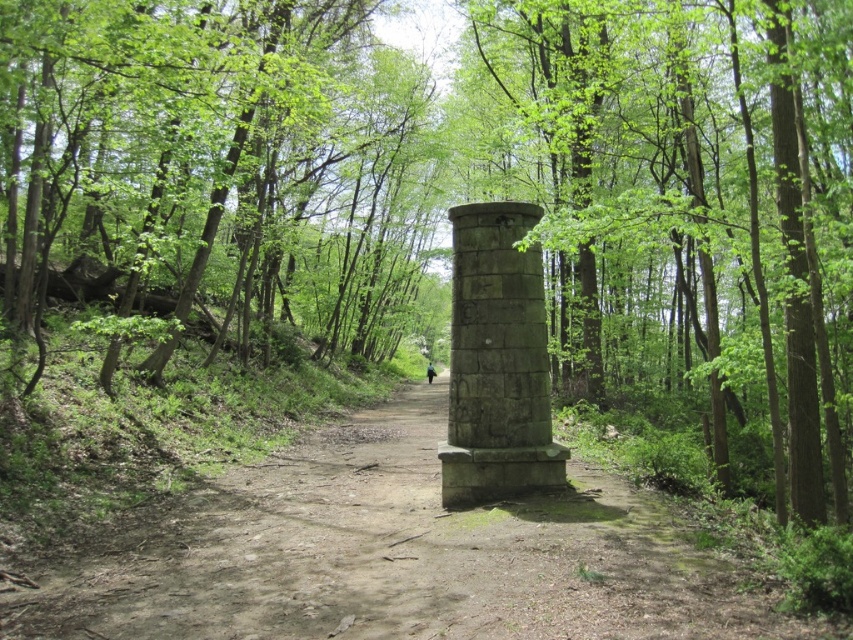
Between dull gray stone path at center and stone column at center, which one has less height?

Standing shorter between the two is dull gray stone path at center.

Is dull gray stone path at center closer to camera compared to stone column at center?

Yes.

Is point (80, 618) farther from viewer compared to point (809, 392)?

No, it is in front of (809, 392).

Where is `dull gray stone path at center`? The image size is (853, 640). dull gray stone path at center is located at coordinates (395, 556).

Who is more forward, (740, 138) or (529, 454)?

Point (529, 454) is in front.

Is point (672, 198) positioned in front of point (518, 397)?

Yes.

Locate an element on the screen. The height and width of the screenshot is (640, 853). stone column at center is located at coordinates (680, 179).

Is point (256, 224) positioned after point (537, 330)?

Yes, point (256, 224) is behind point (537, 330).

Is green leafy trees at left further to camera compared to gray stone column at center?

No, it is in front of gray stone column at center.

At what (x,y) coordinates should I click in order to perform the action: click on green leafy trees at left. Please return your answer as a coordinate pair (x, y). Looking at the image, I should click on (218, 170).